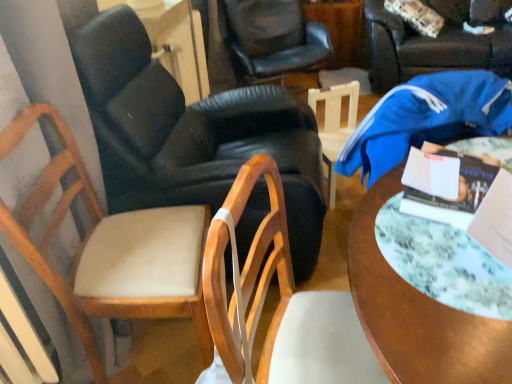
Identify the location of free location above hardcover book at center right (from a real-world perspective). (454, 177).